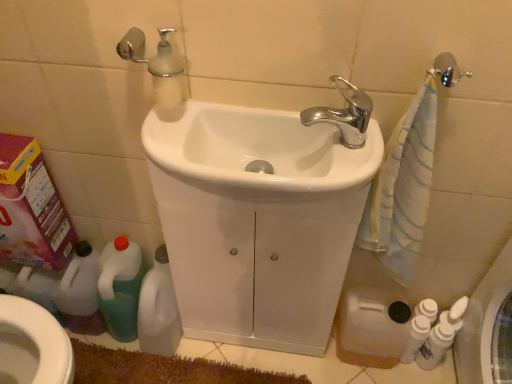
Question: Does white glossy sink at center, the 1th sink viewed from the front, have a greater height compared to white glossy sink at center, acting as the 1th sink starting from the back?

Choices:
 (A) yes
 (B) no

Answer: (B)

Question: Would you say white glossy sink at center, the second sink in the back-to-front sequence, is outside white glossy sink at center, arranged as the 2th sink when viewed from the front?

Choices:
 (A) yes
 (B) no

Answer: (B)

Question: From the image's perspective, would you say white glossy sink at center, the second sink in the back-to-front sequence, is positioned over white glossy sink at center, arranged as the 2th sink when viewed from the front?

Choices:
 (A) yes
 (B) no

Answer: (A)

Question: Considering the relative positions of white glossy sink at center, the second sink in the back-to-front sequence, and white glossy sink at center, arranged as the 2th sink when viewed from the front, in the image provided, is white glossy sink at center, the second sink in the back-to-front sequence, to the right of white glossy sink at center, arranged as the 2th sink when viewed from the front, from the viewer's perspective?

Choices:
 (A) yes
 (B) no

Answer: (B)

Question: From a real-world perspective, is white glossy sink at center, the second sink in the back-to-front sequence, physically below white glossy sink at center, acting as the 1th sink starting from the back?

Choices:
 (A) yes
 (B) no

Answer: (B)

Question: Could you tell me if white glossy sink at center, the 1th sink viewed from the front, is facing white glossy sink at center, acting as the 1th sink starting from the back?

Choices:
 (A) no
 (B) yes

Answer: (B)

Question: Are white glossy bidet at lower left and white plastic bottle at lower left, the second cleaning product viewed from the left, making contact?

Choices:
 (A) yes
 (B) no

Answer: (B)

Question: Is white glossy bidet at lower left smaller than white plastic bottle at lower left, the second cleaning product viewed from the left?

Choices:
 (A) yes
 (B) no

Answer: (A)

Question: Is white glossy bidet at lower left shorter than white plastic bottle at lower left, the second cleaning product viewed from the left?

Choices:
 (A) yes
 (B) no

Answer: (B)

Question: From a real-world perspective, is white glossy bidet at lower left positioned under white plastic bottle at lower left, the second cleaning product viewed from the left, based on gravity?

Choices:
 (A) no
 (B) yes

Answer: (A)

Question: Are white glossy bidet at lower left and white plastic bottle at lower left, the second cleaning product viewed from the left, far apart?

Choices:
 (A) no
 (B) yes

Answer: (A)

Question: From the image's perspective, would you say white glossy bidet at lower left is positioned over white plastic bottle at lower left, positioned as the third cleaning product in right-to-left order?

Choices:
 (A) no
 (B) yes

Answer: (A)

Question: Is white glossy bottles at lower right, which is counted as the 3th cleaning product, starting from the left, to the right of white glossy sink at center, the second sink in the back-to-front sequence, from the viewer's perspective?

Choices:
 (A) yes
 (B) no

Answer: (A)